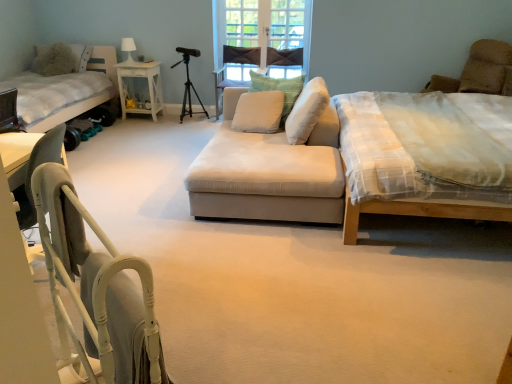
Question: Is white soft pillow at center, the 4th pillow in the back-to-front sequence, bigger than metallic tripod at center?

Choices:
 (A) no
 (B) yes

Answer: (A)

Question: Is white soft pillow at center, marked as the 1th pillow in a right-to-left arrangement, behind metallic tripod at center?

Choices:
 (A) yes
 (B) no

Answer: (B)

Question: Is white soft pillow at center, marked as the 1th pillow in a right-to-left arrangement, at the left side of metallic tripod at center?

Choices:
 (A) yes
 (B) no

Answer: (B)

Question: Is white soft pillow at center, the 4th pillow in the left-to-right sequence, shorter than metallic tripod at center?

Choices:
 (A) no
 (B) yes

Answer: (B)

Question: Is white soft pillow at center, the 4th pillow in the back-to-front sequence, closer to the viewer compared to metallic tripod at center?

Choices:
 (A) no
 (B) yes

Answer: (B)

Question: Are white soft pillow at center, the 1th pillow viewed from the front, and metallic tripod at center located far from each other?

Choices:
 (A) no
 (B) yes

Answer: (B)

Question: Can you confirm if brown suede armchair at upper right is shorter than fluffy white pillow at upper left, which appears as the fourth pillow when viewed from the right?

Choices:
 (A) no
 (B) yes

Answer: (A)

Question: Is brown suede armchair at upper right facing away from fluffy white pillow at upper left, the 1th pillow viewed from the left?

Choices:
 (A) no
 (B) yes

Answer: (A)

Question: Is brown suede armchair at upper right outside fluffy white pillow at upper left, which appears as the fourth pillow when viewed from the right?

Choices:
 (A) no
 (B) yes

Answer: (B)

Question: Is brown suede armchair at upper right positioned before fluffy white pillow at upper left, which is the 1th pillow from back to front?

Choices:
 (A) no
 (B) yes

Answer: (B)

Question: Is brown suede armchair at upper right to the right of fluffy white pillow at upper left, which is the 1th pillow from back to front, from the viewer's perspective?

Choices:
 (A) yes
 (B) no

Answer: (A)

Question: Is brown suede armchair at upper right to the left of fluffy white pillow at upper left, which appears as the fourth pillow when viewed from the right, from the viewer's perspective?

Choices:
 (A) yes
 (B) no

Answer: (B)

Question: Would you say fluffy white pillow at upper left, which is the 1th pillow from back to front, is part of white soft cushion at center, the third pillow from the left,'s contents?

Choices:
 (A) yes
 (B) no

Answer: (B)